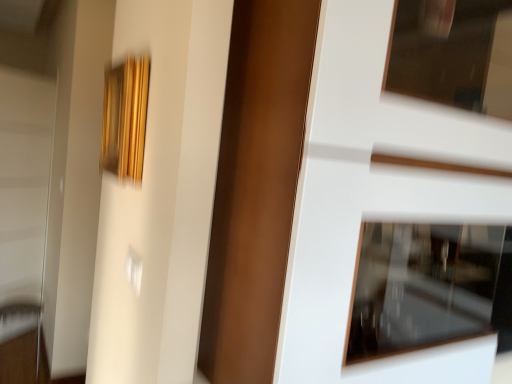
Question: Is there a large distance between white glossy door at center and white glossy screen door at left?

Choices:
 (A) yes
 (B) no

Answer: (A)

Question: Is white glossy door at center thinner than white glossy screen door at left?

Choices:
 (A) no
 (B) yes

Answer: (A)

Question: From a real-world perspective, is white glossy door at center positioned under white glossy screen door at left based on gravity?

Choices:
 (A) yes
 (B) no

Answer: (B)

Question: Can you confirm if white glossy door at center is shorter than white glossy screen door at left?

Choices:
 (A) yes
 (B) no

Answer: (A)

Question: Does white glossy door at center contain white glossy screen door at left?

Choices:
 (A) no
 (B) yes

Answer: (A)

Question: From a real-world perspective, relative to gold textured frame at upper left, is white glossy door at center vertically above or below?

Choices:
 (A) below
 (B) above

Answer: (A)

Question: Considering the positions of white glossy door at center and gold textured frame at upper left in the image, is white glossy door at center taller or shorter than gold textured frame at upper left?

Choices:
 (A) short
 (B) tall

Answer: (B)

Question: Looking at the image, does white glossy door at center seem bigger or smaller compared to gold textured frame at upper left?

Choices:
 (A) big
 (B) small

Answer: (A)

Question: Considering the positions of white glossy door at center and gold textured frame at upper left in the image, is white glossy door at center wider or thinner than gold textured frame at upper left?

Choices:
 (A) thin
 (B) wide

Answer: (B)

Question: Is metallic silver door handle at lower left bigger or smaller than white glossy screen door at left?

Choices:
 (A) big
 (B) small

Answer: (B)

Question: Is point (0, 377) closer or farther from the camera than point (2, 243)?

Choices:
 (A) farther
 (B) closer

Answer: (B)

Question: From the image's perspective, is metallic silver door handle at lower left located above or below white glossy screen door at left?

Choices:
 (A) below
 (B) above

Answer: (A)

Question: Is metallic silver door handle at lower left in front of or behind white glossy screen door at left in the image?

Choices:
 (A) front
 (B) behind

Answer: (A)

Question: In terms of width, does white glossy door at center look wider or thinner when compared to metallic silver door handle at lower left?

Choices:
 (A) wide
 (B) thin

Answer: (A)

Question: Is white glossy door at center to the left or to the right of metallic silver door handle at lower left in the image?

Choices:
 (A) left
 (B) right

Answer: (B)